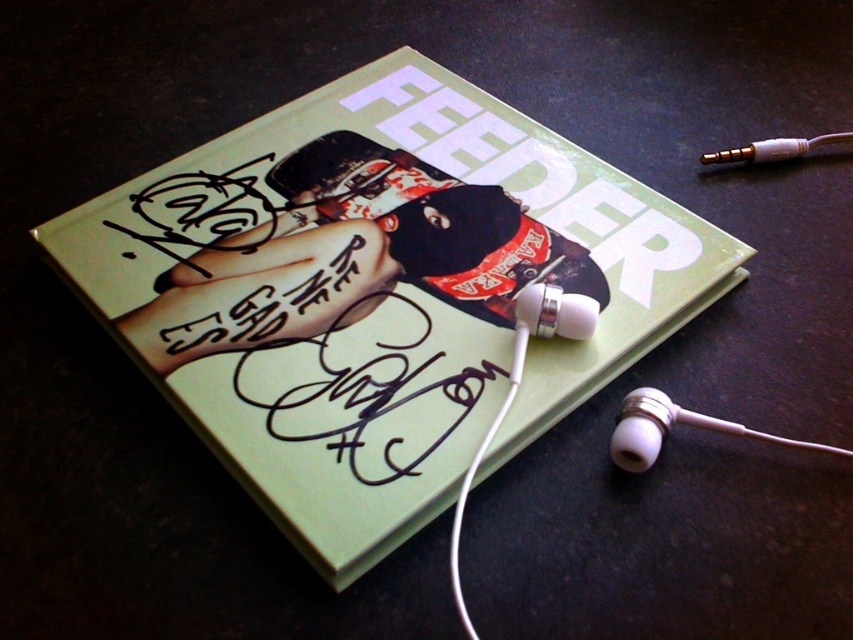
Question: Which of the following is the farthest from the observer?

Choices:
 (A) (624, 403)
 (B) (636, 356)

Answer: (B)

Question: In this image, where is green matte book at center located relative to white plastic earbud at bottom right?

Choices:
 (A) left
 (B) right

Answer: (A)

Question: Which point appears farthest from the camera in this image?

Choices:
 (A) (143, 196)
 (B) (663, 397)

Answer: (A)

Question: Which point is closer to the camera?

Choices:
 (A) green matte book at center
 (B) white plastic earbud at bottom right

Answer: (A)

Question: Can you confirm if green matte book at center is bigger than white plastic earbud at bottom right?

Choices:
 (A) no
 (B) yes

Answer: (B)

Question: Considering the relative positions of green matte book at center and white plastic earbud at bottom right in the image provided, where is green matte book at center located with respect to white plastic earbud at bottom right?

Choices:
 (A) left
 (B) right

Answer: (A)